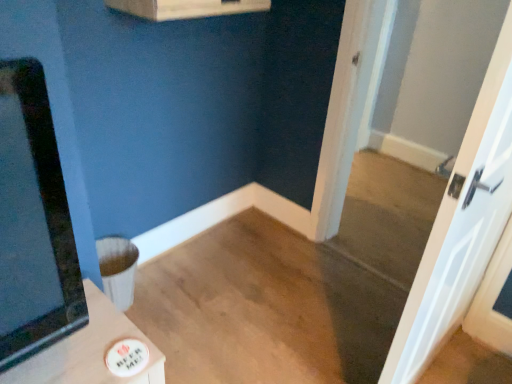
Find the location of a particular element. Image resolution: width=512 pixels, height=384 pixels. white glossy door at right is located at coordinates tap(461, 225).

What is the approximate width of white glossy door at right?

The width of white glossy door at right is 5.53 inches.

What do you see at coordinates (461, 225) in the screenshot? I see `white glossy door at right` at bounding box center [461, 225].

Find the location of a particular element. white glossy door at right is located at coordinates (461, 225).